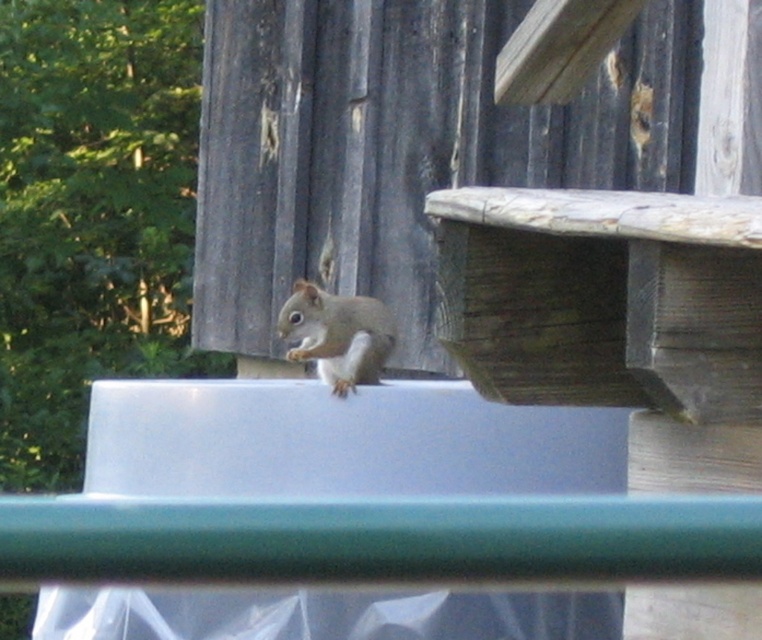
Question: Is smooth plastic tray at upper center positioned at the back of gray fur squirrel at center?

Choices:
 (A) no
 (B) yes

Answer: (A)

Question: Which point is closer to the camera?

Choices:
 (A) smooth plastic tray at upper center
 (B) gray fur squirrel at center

Answer: (A)

Question: Does smooth plastic tray at upper center have a larger size compared to gray fur squirrel at center?

Choices:
 (A) no
 (B) yes

Answer: (B)

Question: Can you confirm if smooth plastic tray at upper center is positioned to the left of gray fur squirrel at center?

Choices:
 (A) yes
 (B) no

Answer: (A)

Question: Which object is farther from the camera taking this photo?

Choices:
 (A) gray fur squirrel at center
 (B) smooth plastic tray at upper center

Answer: (A)